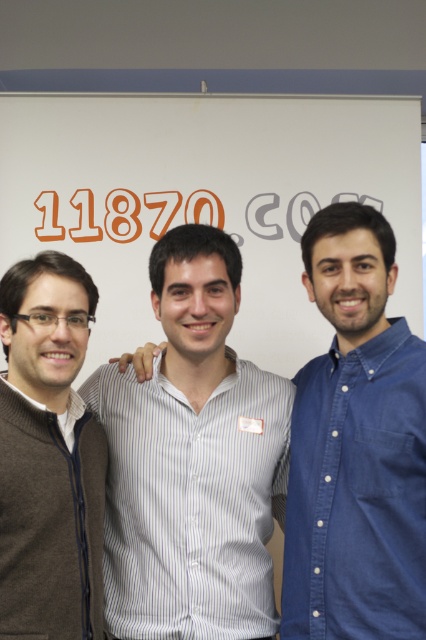
You are a photographer adjusting your camera settings. You need to ensure that both the point at [362,620] and the point at [20,342] are in focus. Given that the depth of field can only sharply focus on one of the points, which point should you prioritize focusing on to capture the most detailed image?

You should prioritize focusing on point [362,620] because it is closer to the camera than point [20,342], ensuring it will be in sharper focus.

You are designing a group photo layout for a company website. The blue denim shirt at right and the brown sweater at left are part of the image. Which clothing item should you scale down to ensure both fit within the frame without distortion?

The blue denim shirt at right is larger in size than the brown sweater at left, so you should scale down the blue denim shirt at right to ensure both fit within the frame without distortion.